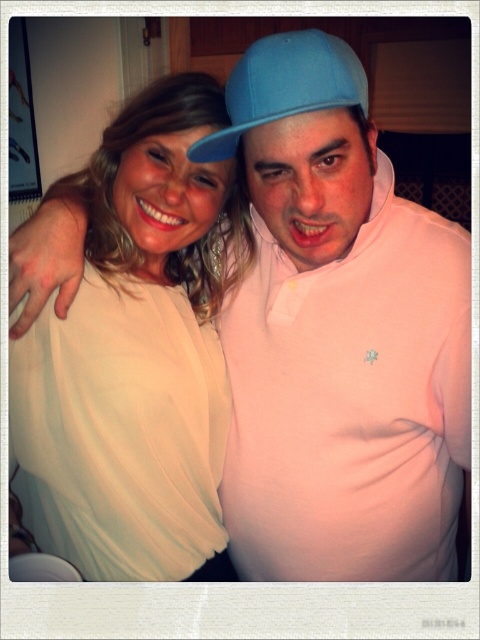
Question: Is matte white blouse at center wider than matte blue cap at center?

Choices:
 (A) no
 (B) yes

Answer: (B)

Question: Which point is closer to the camera taking this photo?

Choices:
 (A) (262, 115)
 (B) (22, 388)

Answer: (A)

Question: Can you confirm if matte white blouse at center is wider than matte blue cap at center?

Choices:
 (A) yes
 (B) no

Answer: (A)

Question: Can you confirm if matte white blouse at center is wider than matte blue cap at center?

Choices:
 (A) yes
 (B) no

Answer: (A)

Question: Which object appears farthest from the camera in this image?

Choices:
 (A) matte blue cap at center
 (B) matte white blouse at center

Answer: (B)